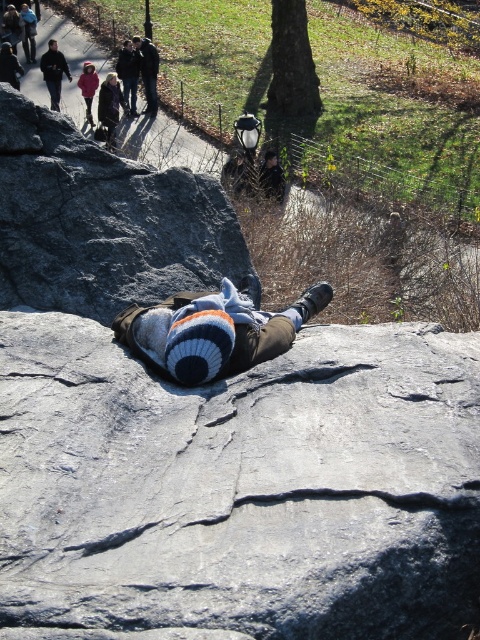
Does knit wool hat at center have a smaller size compared to dark blue knit sweater at upper center?

Indeed, knit wool hat at center has a smaller size compared to dark blue knit sweater at upper center.

Is knit wool hat at center bigger than dark blue knit sweater at upper center?

Actually, knit wool hat at center might be smaller than dark blue knit sweater at upper center.

Between point (243, 349) and point (142, 51), which one is positioned behind?

Positioned behind is point (142, 51).

Locate an element on the screen. This screenshot has height=640, width=480. knit wool hat at center is located at coordinates (214, 330).

Is point (71, 77) more distant than point (80, 76)?

That is False.

Where is `matte black jacket at upper left`? matte black jacket at upper left is located at coordinates (54, 72).

Between gray rough rock at center and dark blue knit sweater at upper center, which one has more height?

dark blue knit sweater at upper center

Does gray rough rock at center lie in front of dark blue knit sweater at upper center?

Yes.

Image resolution: width=480 pixels, height=640 pixels. Identify the location of gray rough rock at center. (241, 484).

Where is `gray rough rock at center`? The width and height of the screenshot is (480, 640). gray rough rock at center is located at coordinates (241, 484).